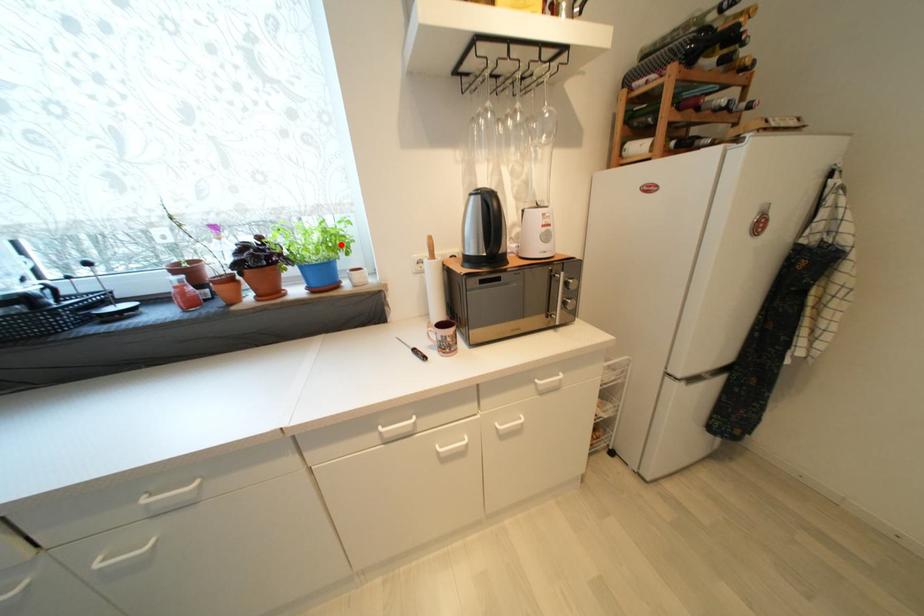
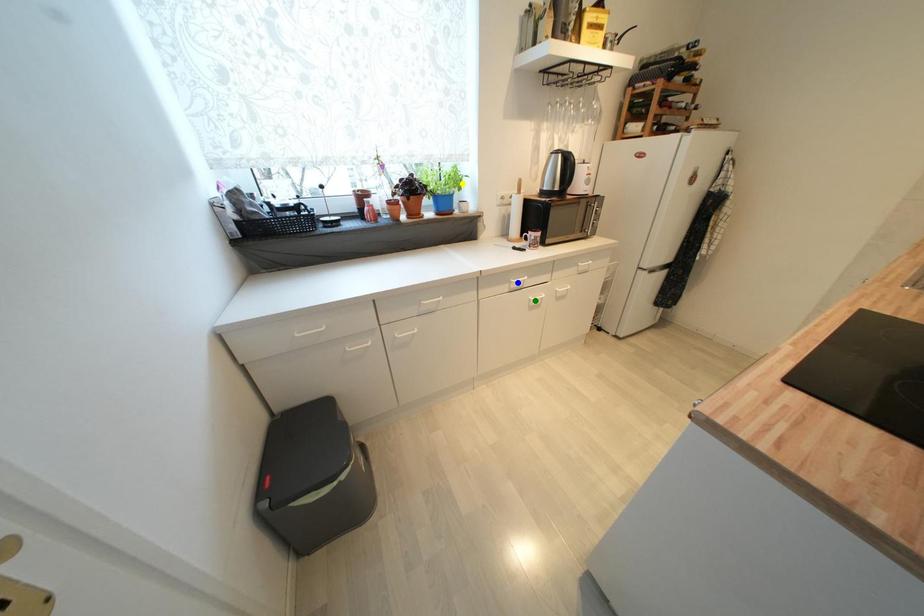
Question: I am providing you with two images of the same scene from different viewpoints. A red point is marked on the first image. You are given multiple points on the second image. In image 2, which mark is for the same physical point as the one in image 1?

Choices:
 (A) yellow point
 (B) blue point
 (C) green point

Answer: (A)